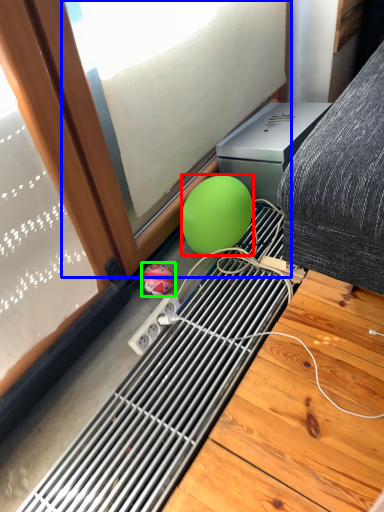
Question: Which is nearer to the ball (highlighted by a red box)? window (highlighted by a blue box) or ball (highlighted by a green box).

Choices:
 (A) window
 (B) ball

Answer: (B)